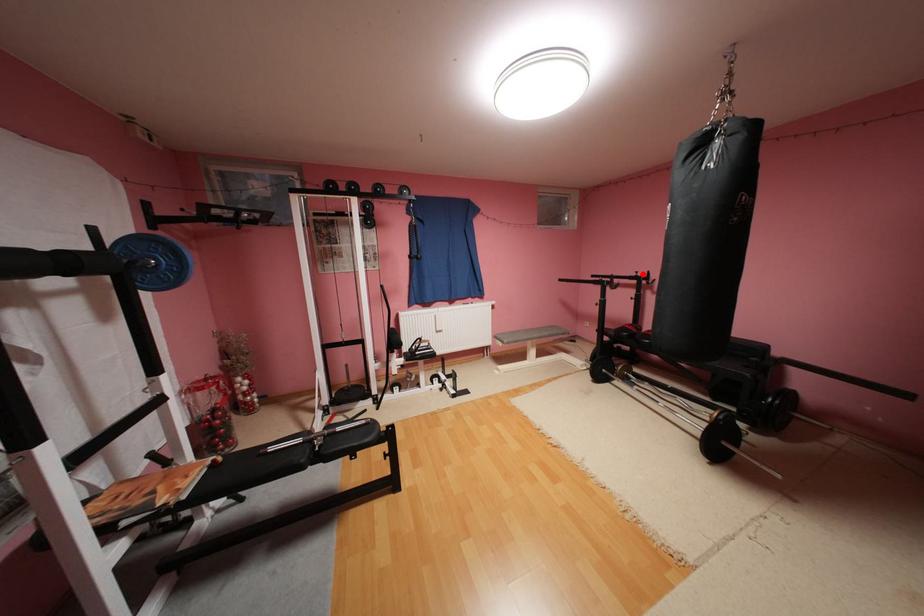
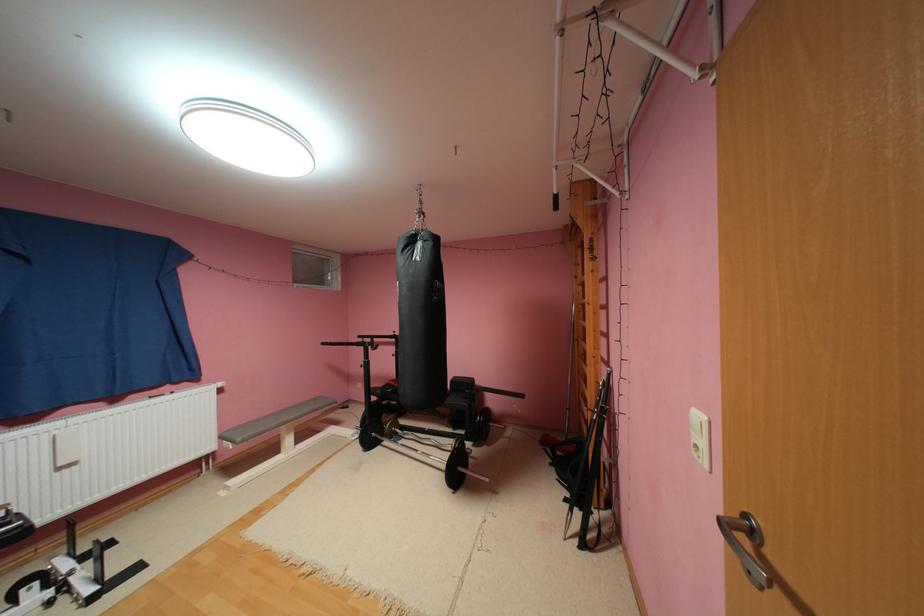
In the second image, find the point that corresponds to the highlighted location in the first image.

(400, 334)